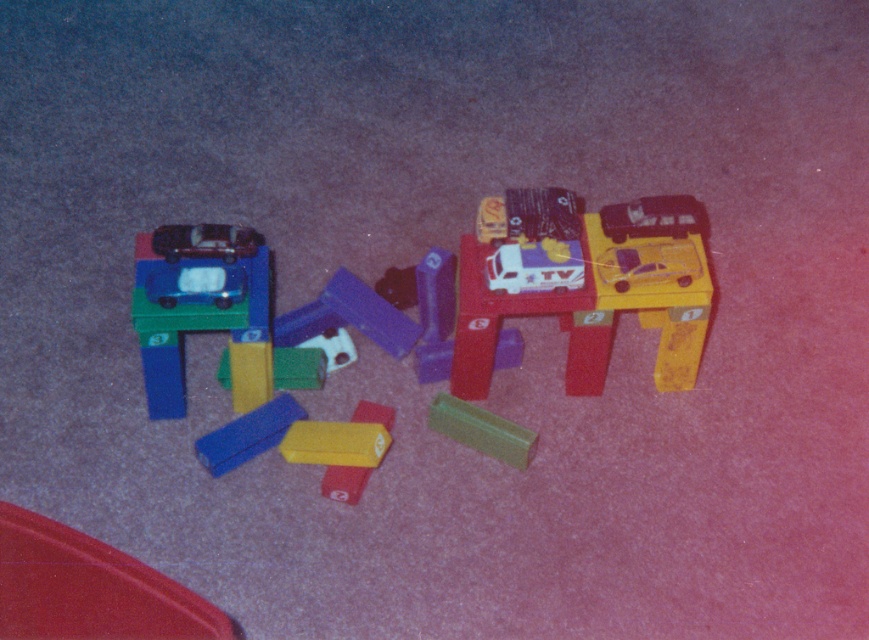
In the scene shown: Is matte plastic toy car at upper left smaller than matte plastic car at left?

No.

Who is shorter, matte plastic toy car at upper left or matte plastic car at left?

matte plastic car at left

Does point (661, 296) come in front of point (197, 301)?

No.

This screenshot has height=640, width=869. Identify the location of matte plastic toy car at upper left. (582, 282).

Looking at this image, is blue matte block at lower center shorter than green matte block at center?

No, blue matte block at lower center is not shorter than green matte block at center.

Where is `blue matte block at lower center`? blue matte block at lower center is located at coordinates [247, 435].

Identify the location of blue matte block at lower center. This screenshot has width=869, height=640. (247, 435).

Who is more distant from viewer, (533,304) or (242,232)?

Point (533,304)

Does point (456, 333) come farther from viewer compared to point (237, 241)?

Yes, it is.

Does point (523, 250) come farther from viewer compared to point (174, 237)?

Yes, it is.

This screenshot has height=640, width=869. Find the location of `matte plastic toy car at upper left`. matte plastic toy car at upper left is located at coordinates (582, 282).